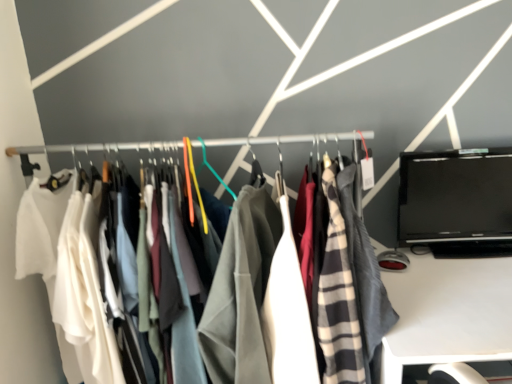
In order to click on blank space situated above white plastic desk at lower right (from a real-world perspective) in this screenshot , I will do click(448, 288).